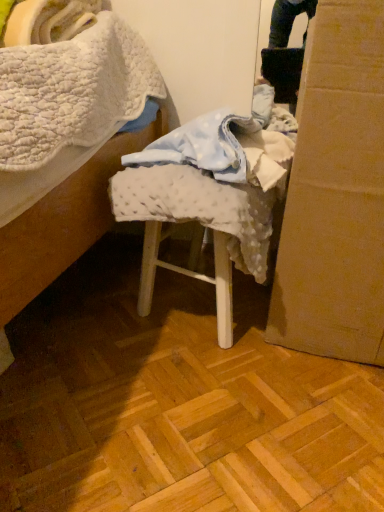
Measure the distance between point (x=325, y=158) and camera.

A distance of 25.31 inches exists between point (x=325, y=158) and camera.

This screenshot has width=384, height=512. What do you see at coordinates (336, 193) in the screenshot?
I see `cardboard box at right` at bounding box center [336, 193].

You are a GUI agent. You are given a task and a screenshot of the screen. Output one action in this format:
    pyautogui.click(x=<x>, y=<y>)
    Task: Click on the cardboard box at right
    The image size is (384, 512).
    Given the screenshot: What is the action you would take?
    pyautogui.click(x=336, y=193)

The width and height of the screenshot is (384, 512). Describe the element at coordinates (209, 198) in the screenshot. I see `white dotted fabric at center` at that location.

Locate an element on the screen. The height and width of the screenshot is (512, 384). white dotted fabric at center is located at coordinates (209, 198).

Find the location of a particular element. The height and width of the screenshot is (512, 384). cardboard box at right is located at coordinates (336, 193).

Considering the relative positions of cardboard box at right and white dotted fabric at center in the image provided, is cardboard box at right to the left or to the right of white dotted fabric at center?

cardboard box at right is to the right of white dotted fabric at center.

Which object is more forward, cardboard box at right or white dotted fabric at center?

cardboard box at right.

Is point (299, 300) more distant than point (173, 140)?

Yes, point (299, 300) is farther from viewer.

From the image's perspective, between cardboard box at right and white dotted fabric at center, which one is located above?

cardboard box at right.

From a real-world perspective, which object stands above the other?

A: From a 3D spatial view, cardboard box at right is above.

Does cardboard box at right have a greater width compared to white dotted fabric at center?

Yes, cardboard box at right is wider than white dotted fabric at center.

From the picture: Is cardboard box at right taller than white dotted fabric at center?

Indeed, cardboard box at right has a greater height compared to white dotted fabric at center.

Does cardboard box at right have a smaller size compared to white dotted fabric at center?

No, cardboard box at right is not smaller than white dotted fabric at center.

Would you say cardboard box at right is inside or outside white dotted fabric at center?

The correct answer is: outside.

Can you see cardboard box at right touching white dotted fabric at center?

cardboard box at right is not next to white dotted fabric at center, and they're not touching.

Could you tell me if cardboard box at right is facing white dotted fabric at center?

No.

This screenshot has height=512, width=384. Find the location of `cardboard box that is above the white dotted fabric at center (from a real-world perspective)`. cardboard box that is above the white dotted fabric at center (from a real-world perspective) is located at coordinates (336, 193).

In the image, is white dotted fabric at center on the left side or the right side of cardboard box at right?

Clearly, white dotted fabric at center is on the left of cardboard box at right in the image.

Which is behind, white dotted fabric at center or cardboard box at right?

white dotted fabric at center is further from the camera.

Which is farther from the camera, (269,213) or (348,127)?

Point (269,213)

From the image's perspective, which is above, white dotted fabric at center or cardboard box at right?

cardboard box at right appears higher in the image.

From a real-world perspective, which object rests below the other?

white dotted fabric at center.

Considering the relative sizes of white dotted fabric at center and cardboard box at right in the image provided, is white dotted fabric at center wider than cardboard box at right?

No.

Considering the relative sizes of white dotted fabric at center and cardboard box at right in the image provided, is white dotted fabric at center shorter than cardboard box at right?

Yes.

Who is bigger, white dotted fabric at center or cardboard box at right?

cardboard box at right.

Is white dotted fabric at center located outside cardboard box at right?

Yes, white dotted fabric at center is not within cardboard box at right.

Is white dotted fabric at center far from cardboard box at right?

That's not correct — white dotted fabric at center is a little close to cardboard box at right.

Could you tell me if white dotted fabric at center is facing cardboard box at right?

No, white dotted fabric at center does not turn towards cardboard box at right.

Locate an element on the screen. The height and width of the screenshot is (512, 384). cardboard box to the right of white dotted fabric at center is located at coordinates (336, 193).

Where is `chair behind the cardboard box at right`? The height and width of the screenshot is (512, 384). chair behind the cardboard box at right is located at coordinates (209, 198).

The image size is (384, 512). I want to click on cardboard box to the right of white dotted fabric at center, so pyautogui.click(x=336, y=193).